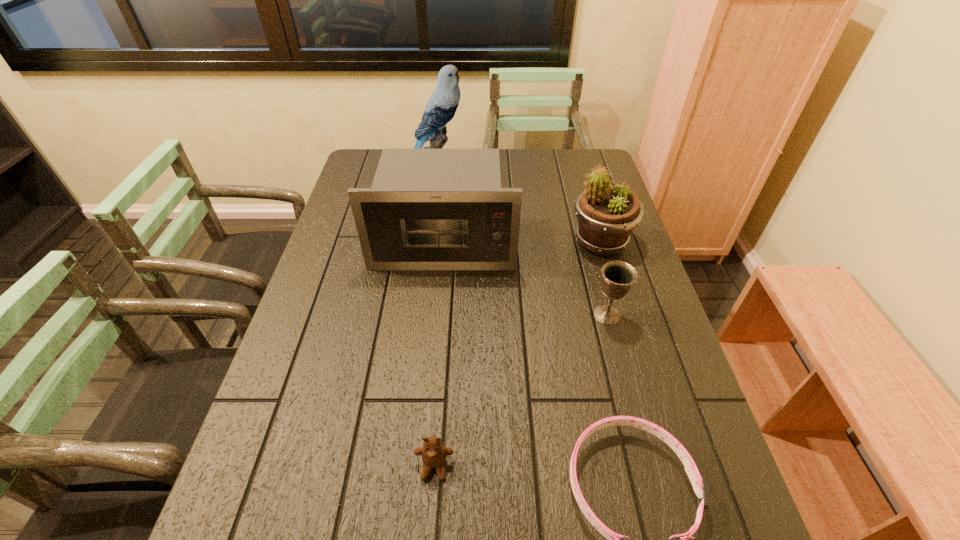
Where is `vacant space that is in between the tallest object and the fifth tallest object`? Image resolution: width=960 pixels, height=540 pixels. vacant space that is in between the tallest object and the fifth tallest object is located at coordinates (435, 321).

Locate which object ranks third in proximity to the flowerpot. Please provide its 2D coordinates. Your answer should be formatted as a tuple, i.e. [(x, y)], where the tuple contains the x and y coordinates of a point satisfying the conditions above.

[(441, 107)]

The width and height of the screenshot is (960, 540). I want to click on object that is the third closest to the flowerpot, so click(x=441, y=107).

The width and height of the screenshot is (960, 540). What are the coordinates of `free space that satisfies the following two spatial constraints: 1. on the face of the third shortest object; 2. on the right side of the farthest object` in the screenshot? It's located at (416, 315).

Image resolution: width=960 pixels, height=540 pixels. What are the coordinates of `free location that satisfies the following two spatial constraints: 1. on the face of the tallest object; 2. on the right side of the third nearest object` in the screenshot? It's located at (416, 315).

I want to click on free spot that satisfies the following two spatial constraints: 1. on the back side of the flowerpot; 2. on the face of the tallest object, so click(x=581, y=175).